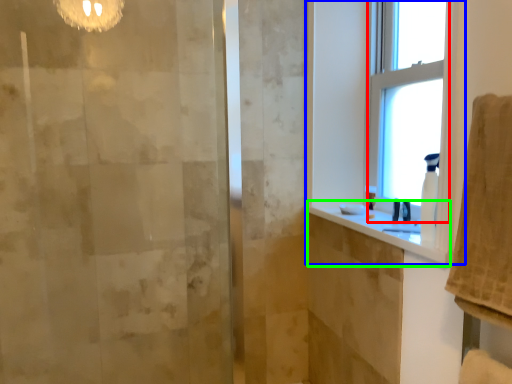
Question: Estimate the real-world distances between objects in this image. Which object is closer to window (highlighted by a red box), window (highlighted by a blue box) or counter top (highlighted by a green box)?

Choices:
 (A) window
 (B) counter top

Answer: (A)